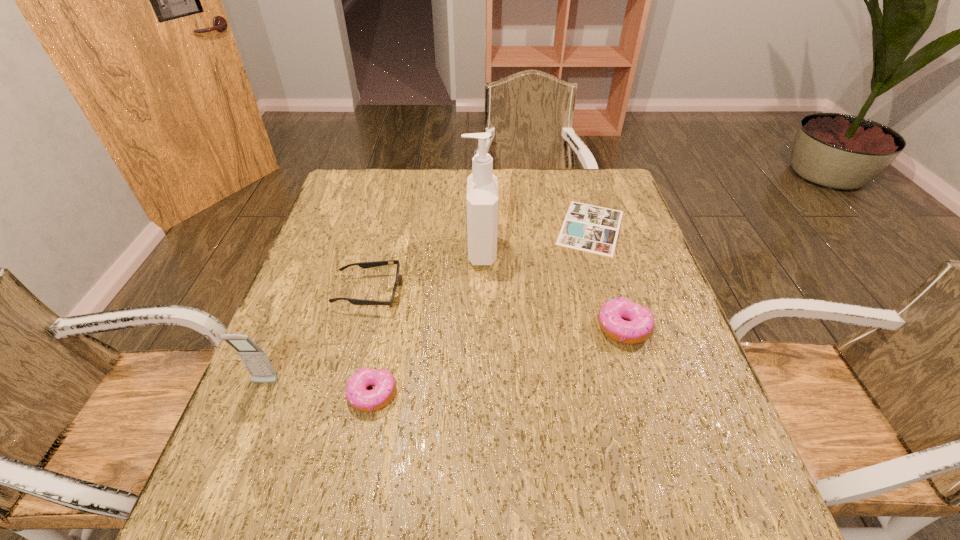
If we want them evenly spaced by inserting an extra doughnut among them, please locate a free spot for this new doughnut. Please provide its 2D coordinates. Your answer should be formatted as a tuple, i.e. [(x, y)], where the tuple contains the x and y coordinates of a point satisfying the conditions above.

[(506, 359)]